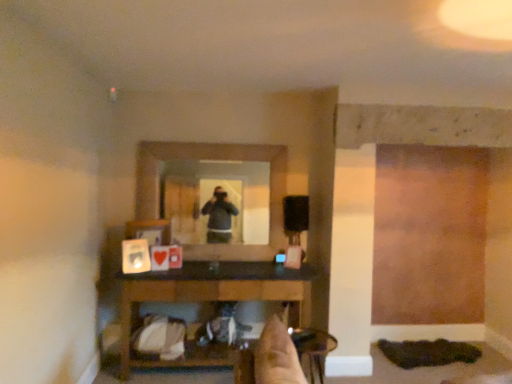
The height and width of the screenshot is (384, 512). Identify the location of metallic silver chair at lower center. (313, 348).

The height and width of the screenshot is (384, 512). What are the coordinates of `metallic silver chair at lower center` in the screenshot? It's located at tap(313, 348).

Which of these two, clear glass mirror at center or wooden table at lower center, is smaller?

clear glass mirror at center is smaller.

Between point (176, 192) and point (247, 291), which one is positioned in front?

The point (247, 291) is more forward.

How many degrees apart are the facing directions of clear glass mirror at center and wooden table at lower center?

There is a 1.32-degree angle between the facing directions of clear glass mirror at center and wooden table at lower center.

Considering the sizes of objects clear glass mirror at center and wooden table at lower center in the image provided, who is thinner, clear glass mirror at center or wooden table at lower center?

clear glass mirror at center.

Is wooden table at lower center far from clear glass mirror at center?

No, wooden table at lower center is in close proximity to clear glass mirror at center.

Where is `mirror positioned vertically above the wooden table at lower center (from a real-world perspective)`? mirror positioned vertically above the wooden table at lower center (from a real-world perspective) is located at coordinates (219, 201).

Is wooden table at lower center thinner than clear glass mirror at center?

In fact, wooden table at lower center might be wider than clear glass mirror at center.

Is clear glass mirror at center at the left side of metallic silver chair at lower center?

Correct, you'll find clear glass mirror at center to the left of metallic silver chair at lower center.

Does clear glass mirror at center have a lesser height compared to metallic silver chair at lower center?

No, clear glass mirror at center is not shorter than metallic silver chair at lower center.

Is metallic silver chair at lower center at the back of clear glass mirror at center?

No, metallic silver chair at lower center is not at the back of clear glass mirror at center.

In the scene shown: Which object is wider, clear glass mirror at center or metallic silver chair at lower center?

Wider between the two is metallic silver chair at lower center.

Considering the positions of point (298, 346) and point (137, 284), is point (298, 346) closer or farther from the camera than point (137, 284)?

Point (298, 346).

Is metallic silver chair at lower center positioned before wooden table at lower center?

Yes, it is in front of wooden table at lower center.

Is metallic silver chair at lower center bigger or smaller than wooden table at lower center?

Clearly, metallic silver chair at lower center is smaller in size than wooden table at lower center.

From a real-world perspective, which is physically above, metallic silver chair at lower center or wooden table at lower center?

wooden table at lower center, from a real-world perspective.

From a real-world perspective, is wooden table at lower center over metallic silver chair at lower center?

Yes, from a real-world perspective, wooden table at lower center is above metallic silver chair at lower center.

How distant is wooden table at lower center from metallic silver chair at lower center?

wooden table at lower center and metallic silver chair at lower center are 33.96 inches apart.

Would you say wooden table at lower center is to the left or to the right of metallic silver chair at lower center in the picture?

wooden table at lower center is to the left of metallic silver chair at lower center.

Is wooden table at lower center facing towards metallic silver chair at lower center?

Yes, wooden table at lower center is turned towards metallic silver chair at lower center.

Which of these two, metallic silver chair at lower center or clear glass mirror at center, stands taller?

clear glass mirror at center is taller.

From a real-world perspective, relative to clear glass mirror at center, is metallic silver chair at lower center vertically above or below?

In terms of real-world spatial position, metallic silver chair at lower center is below clear glass mirror at center.

Which object is positioned more to the right, metallic silver chair at lower center or clear glass mirror at center?

From the viewer's perspective, metallic silver chair at lower center appears more on the right side.

Locate an element on the screen. mirror above the wooden table at lower center (from the image's perspective) is located at coordinates (219, 201).

Where is `table in front of the clear glass mirror at center`? This screenshot has height=384, width=512. table in front of the clear glass mirror at center is located at coordinates (206, 300).

From the image, which object appears to be nearer to metallic silver chair at lower center, clear glass mirror at center or wooden table at lower center?

Based on the image, wooden table at lower center appears to be nearer to metallic silver chair at lower center.

Based on their spatial positions, is wooden table at lower center or metallic silver chair at lower center closer to clear glass mirror at center?

wooden table at lower center lies closer to clear glass mirror at center than the other object.

Looking at the image, which one is located further to wooden table at lower center, metallic silver chair at lower center or clear glass mirror at center?

Among the two, metallic silver chair at lower center is located further to wooden table at lower center.

When comparing their distances from clear glass mirror at center, does metallic silver chair at lower center or wooden table at lower center seem closer?

Based on the image, wooden table at lower center appears to be nearer to clear glass mirror at center.

When comparing their distances from wooden table at lower center, does clear glass mirror at center or metallic silver chair at lower center seem closer?

Among the two, clear glass mirror at center is located nearer to wooden table at lower center.

Considering their positions, is wooden table at lower center positioned further to metallic silver chair at lower center than clear glass mirror at center?

clear glass mirror at center.

Image resolution: width=512 pixels, height=384 pixels. I want to click on table that lies between clear glass mirror at center and metallic silver chair at lower center from top to bottom, so [x=206, y=300].